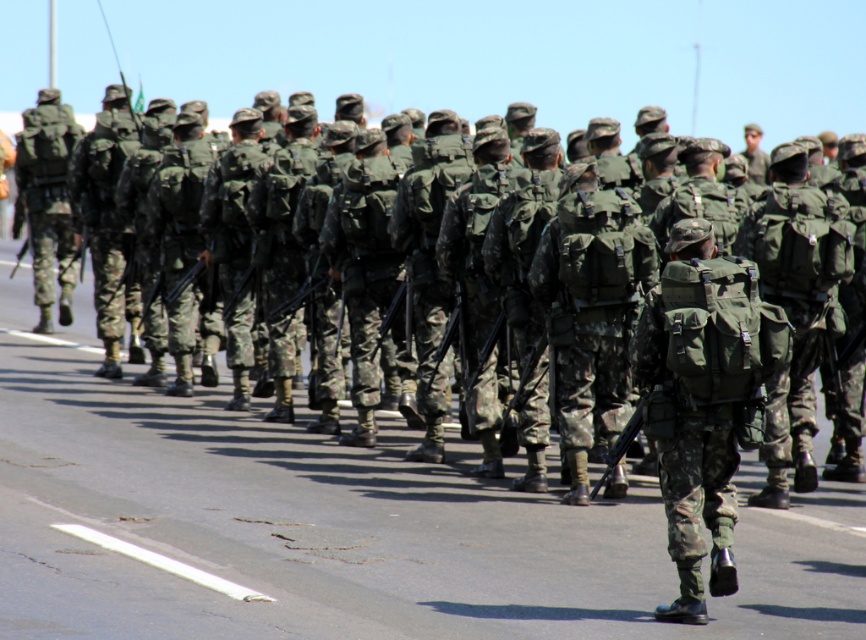
Between camo fabric backpack at center and white asphalt at lower left, which one has less height?

white asphalt at lower left

Who is more forward, (654,307) or (94,541)?

Point (654,307) is more forward.

The image size is (866, 640). What are the coordinates of `camo fabric backpack at center` in the screenshot? It's located at (703, 401).

Can you confirm if camouflage fabric backpack at center is bigger than matte green backpack at center-right?

Actually, camouflage fabric backpack at center might be smaller than matte green backpack at center-right.

At what (x,y) coordinates should I click in order to perform the action: click on camouflage fabric backpack at center. Please return your answer as a coordinate pair (x, y). Image resolution: width=866 pixels, height=640 pixels. Looking at the image, I should click on (592, 308).

The height and width of the screenshot is (640, 866). I want to click on camouflage fabric backpack at center, so click(x=592, y=308).

Can you confirm if camo fabric backpack at center is thinner than camouflage fabric backpack at center?

Correct, camo fabric backpack at center's width is less than camouflage fabric backpack at center's.

Does camo fabric backpack at center have a greater width compared to camouflage fabric backpack at center?

Incorrect, camo fabric backpack at center's width does not surpass camouflage fabric backpack at center's.

Where is `camo fabric backpack at center`? Image resolution: width=866 pixels, height=640 pixels. camo fabric backpack at center is located at coordinates (703, 401).

Identify the location of camo fabric backpack at center. This screenshot has width=866, height=640. (703, 401).